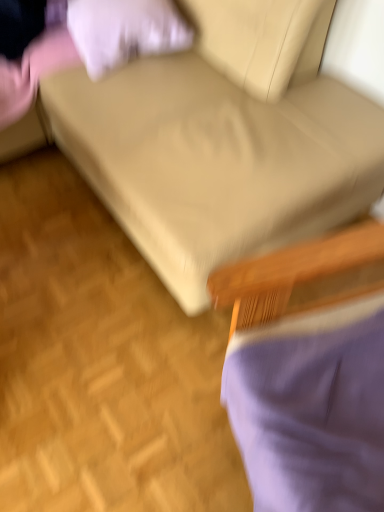
Question: Is beige fabric couch at center bigger or smaller than white soft pillow at upper left?

Choices:
 (A) big
 (B) small

Answer: (A)

Question: In the image, is beige fabric couch at center positioned in front of or behind white soft pillow at upper left?

Choices:
 (A) front
 (B) behind

Answer: (A)

Question: Based on their relative distances, which object is nearer to the purple fabric chair at lower right?

Choices:
 (A) beige fabric couch at center
 (B) white soft pillow at upper left

Answer: (A)

Question: Which of these objects is positioned farthest from the beige fabric couch at center?

Choices:
 (A) white soft pillow at upper left
 (B) purple fabric chair at lower right

Answer: (B)